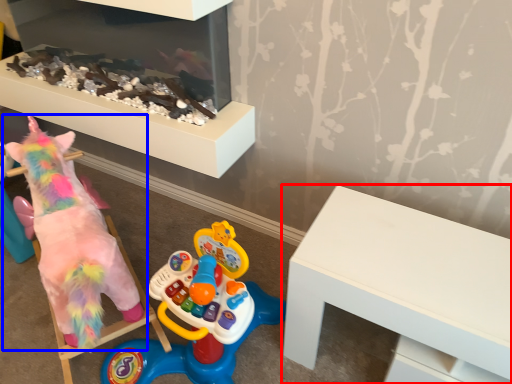
Question: Which object appears closest to the camera in this image, table (highlighted by a red box) or toy (highlighted by a blue box)?

Choices:
 (A) table
 (B) toy

Answer: (A)